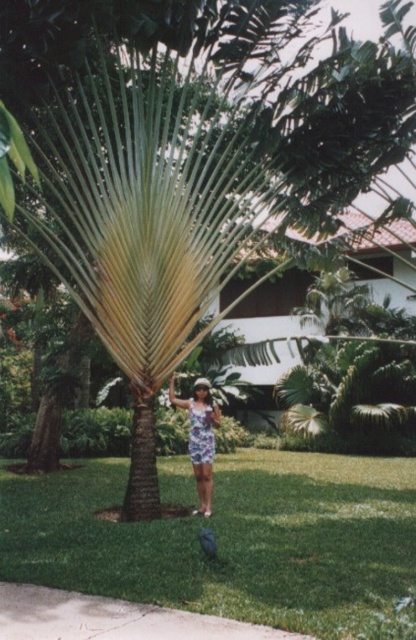
Can you confirm if concrete sidewalk at lower center is smaller than printed fabric dress at center?

Yes, concrete sidewalk at lower center is smaller than printed fabric dress at center.

Between concrete sidewalk at lower center and printed fabric dress at center, which one appears on the left side from the viewer's perspective?

Positioned to the left is concrete sidewalk at lower center.

Does point (116, 632) come behind point (192, 420)?

No, it is not.

Where is `concrete sidewalk at lower center`? The image size is (416, 640). concrete sidewalk at lower center is located at coordinates (111, 618).

Does green grass at center appear over concrete sidewalk at lower center?

No, green grass at center is not above concrete sidewalk at lower center.

Which is in front, point (294, 593) or point (208, 634)?

Positioned in front is point (208, 634).

Locate an element on the screen. This screenshot has width=416, height=640. green grass at center is located at coordinates (227, 538).

Does point (279, 598) come in front of point (178, 400)?

Yes, point (279, 598) is closer to viewer.

Locate an element on the screen. Image resolution: width=416 pixels, height=640 pixels. green grass at center is located at coordinates (227, 538).

Is point (321, 566) more distant than point (198, 442)?

No, it is not.

Where is `green grass at center`? This screenshot has width=416, height=640. green grass at center is located at coordinates (227, 538).